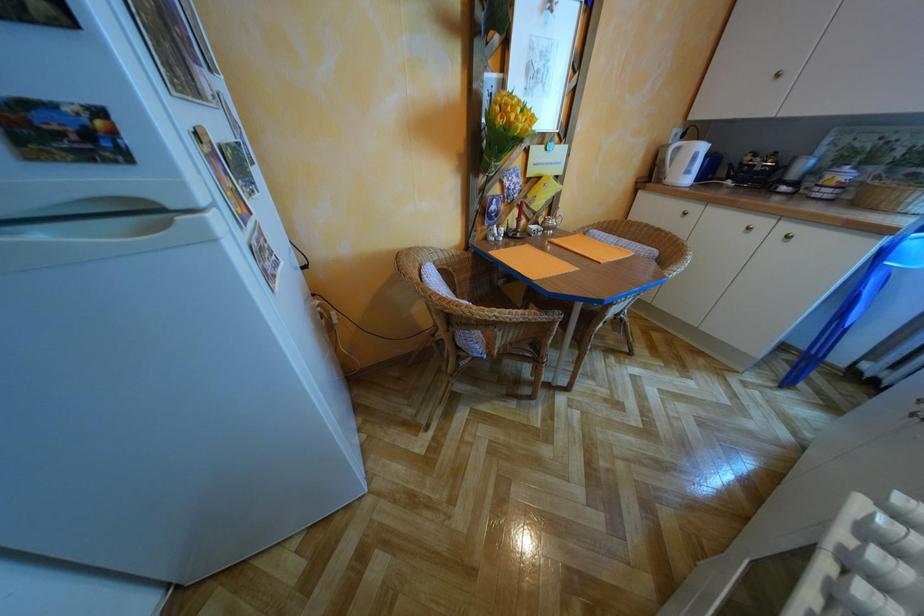
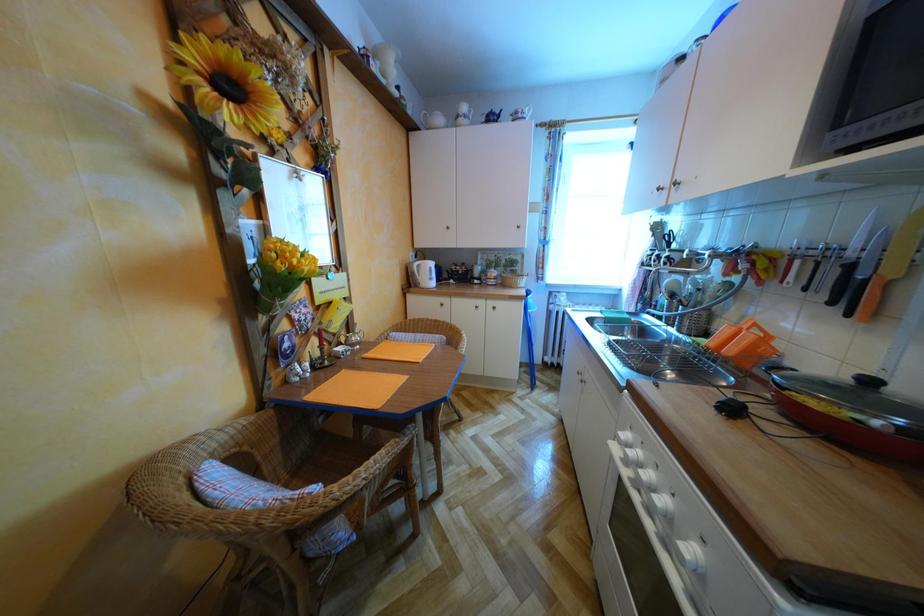
Question: The camera is either moving clockwise (left) or counter-clockwise (right) around the object. The first image is from the beginning of the video and the second image is from the end. Is the camera moving left or right when shooting the video?

Choices:
 (A) Left
 (B) Right

Answer: (A)